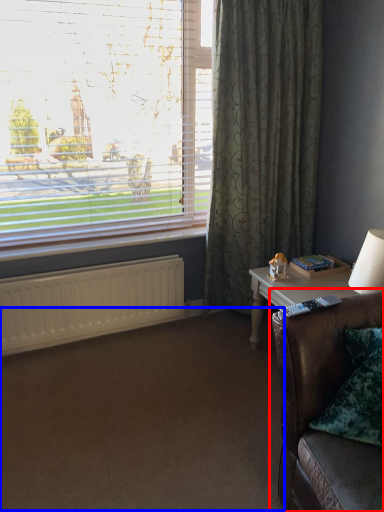
Question: Which object appears farthest to the camera in this image, studio couch (highlighted by a red box) or plain (highlighted by a blue box)?

Choices:
 (A) studio couch
 (B) plain

Answer: (B)